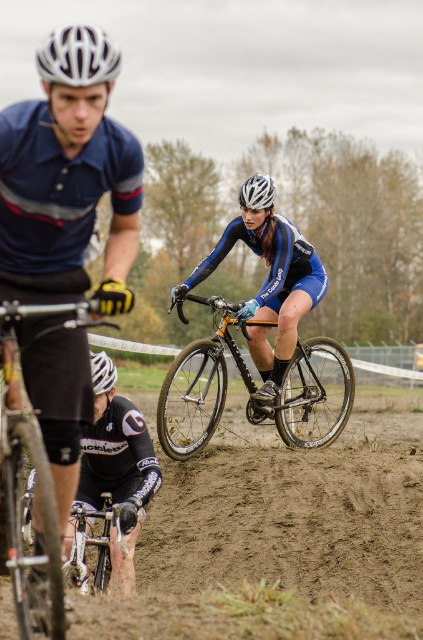
Looking at this image, you are a photographer positioned at the starting line of the cyclocross race. You want to capture a photo that includes both the cyclist in the center and a specific point on the track. The cyclist is located at point (162, 417), and the point you want to highlight is at (112, 372). Since you can only focus on one point clearly, which point should you focus on to ensure the cyclist remains in focus while the other point appears slightly blurred?

You should focus on point (162, 417) where the cyclist is located because it is closer to you than point (112, 372). By focusing on the closer point, the cyclist will be in sharp focus, while the farther point will naturally appear slightly blurred in the background.